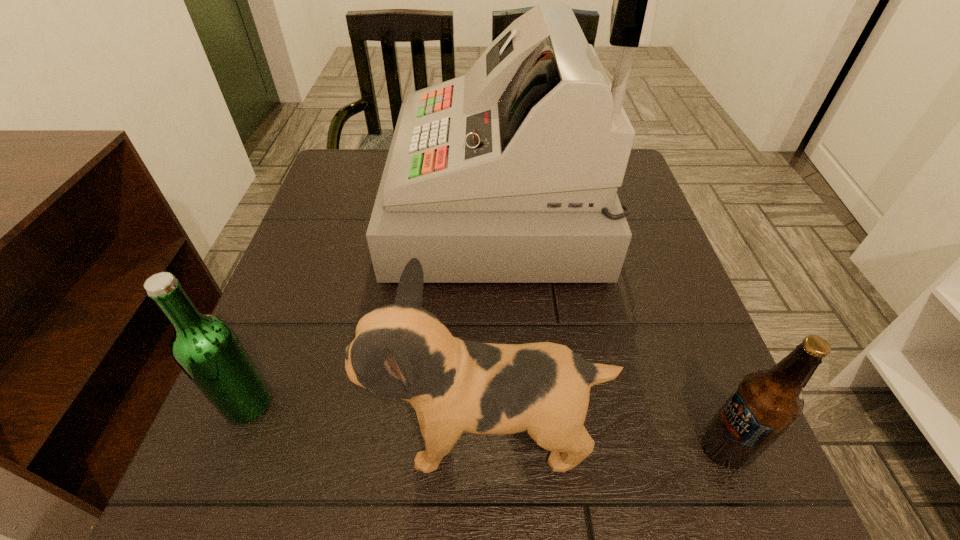
The image size is (960, 540). What are the coordinates of `cash register` in the screenshot? It's located at (508, 174).

You are a GUI agent. You are given a task and a screenshot of the screen. Output one action in this format:
    pyautogui.click(x=<x>, y=<y>)
    Task: Click on the farthest object
    
    Given the screenshot: What is the action you would take?
    pyautogui.click(x=508, y=174)

Identify the location of puppy. The width and height of the screenshot is (960, 540). (401, 350).

You are a GUI agent. You are given a task and a screenshot of the screen. Output one action in this format:
    pyautogui.click(x=<x>, y=<y>)
    Task: Click on the left beer bottle
    The height and width of the screenshot is (540, 960).
    Given the screenshot: What is the action you would take?
    pyautogui.click(x=206, y=348)

This screenshot has width=960, height=540. I want to click on the right beer bottle, so click(766, 403).

I want to click on free location located on the keypad side of the farthest object, so click(x=374, y=208).

The width and height of the screenshot is (960, 540). I want to click on free space located 0.200m on the keypad side of the farthest object, so click(311, 208).

I want to click on free location located 0.160m on the keypad side of the farthest object, so click(328, 208).

This screenshot has width=960, height=540. I want to click on vacant space located 0.180m at the face of the puppy, so 253,434.

Locate an element on the screen. The image size is (960, 540). free location located at the face of the puppy is located at coordinates (x=234, y=434).